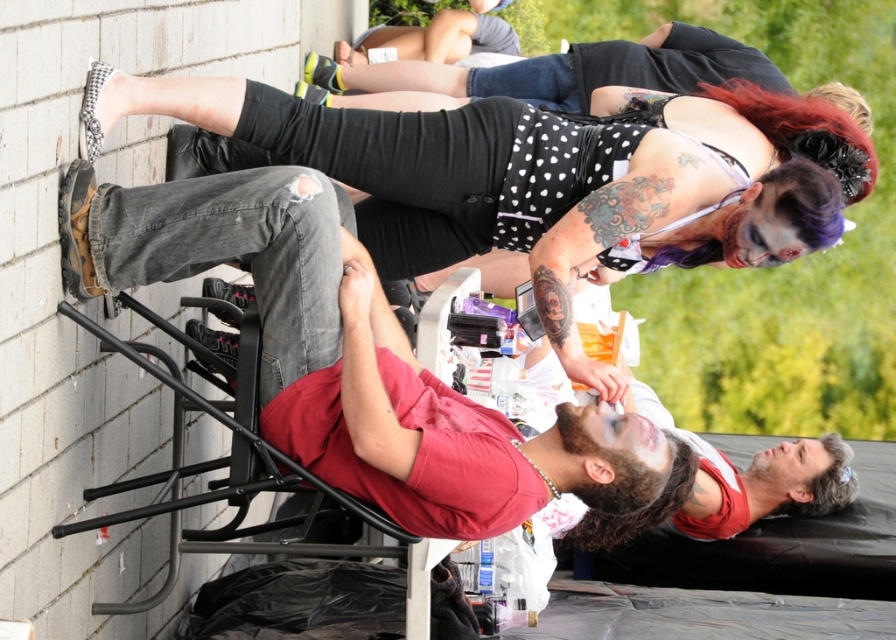
Question: Which point is farther to the camera?

Choices:
 (A) matte red shirt at center
 (B) polka dot fabric dress at upper center

Answer: (B)

Question: Is the position of polka dot fabric dress at upper center more distant than that of matte red shirt at center?

Choices:
 (A) no
 (B) yes

Answer: (B)

Question: Is polka dot fabric dress at upper center bigger than matte red shirt at center?

Choices:
 (A) yes
 (B) no

Answer: (A)

Question: Among these points, which one is nearest to the camera?

Choices:
 (A) (377, 177)
 (B) (574, 420)

Answer: (B)

Question: Which of the following is the closest to the observer?

Choices:
 (A) (556, 428)
 (B) (412, 115)

Answer: (A)

Question: Can you confirm if polka dot fabric dress at upper center is positioned below matte red shirt at center?

Choices:
 (A) no
 (B) yes

Answer: (A)